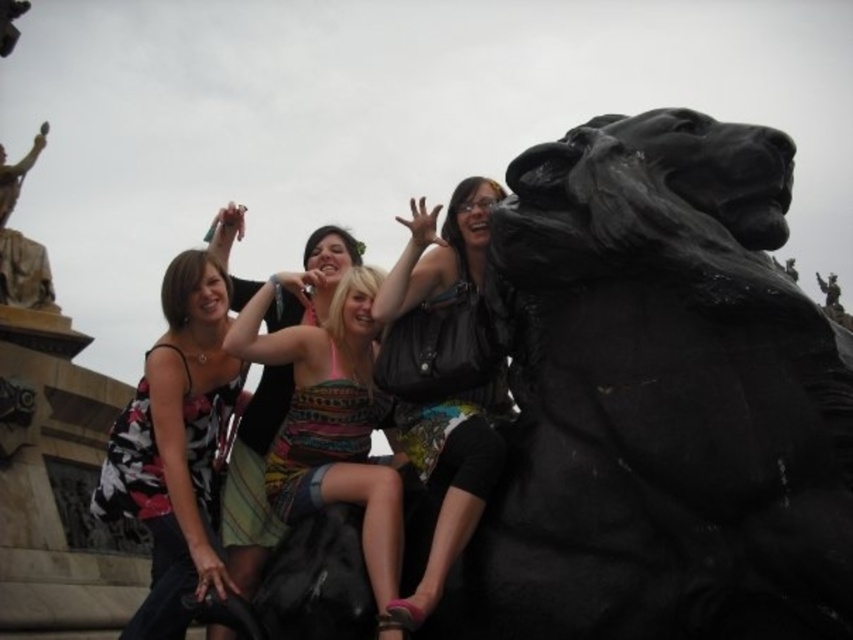
Question: Does floral print tank top at left have a smaller size compared to patterned fabric dress at center?

Choices:
 (A) no
 (B) yes

Answer: (A)

Question: In this image, where is floral print tank top at left located relative to bronze statue at upper left?

Choices:
 (A) right
 (B) left

Answer: (A)

Question: Among these objects, which one is nearest to the camera?

Choices:
 (A) bronze statue at upper left
 (B) floral print tank top at left
 (C) leather jacket at right
 (D) patterned fabric dress at center

Answer: (C)

Question: Which object is closer to the camera taking this photo?

Choices:
 (A) leather jacket at right
 (B) floral print tank top at left
 (C) bronze statue at upper left
 (D) patterned fabric dress at center

Answer: (A)

Question: Is patterned fabric dress at center closer to camera compared to leather jacket at right?

Choices:
 (A) no
 (B) yes

Answer: (A)

Question: Estimate the real-world distances between objects in this image. Which object is closer to the leather jacket at right?

Choices:
 (A) floral print tank top at left
 (B) patterned fabric dress at center
 (C) bronze statue at upper left

Answer: (B)